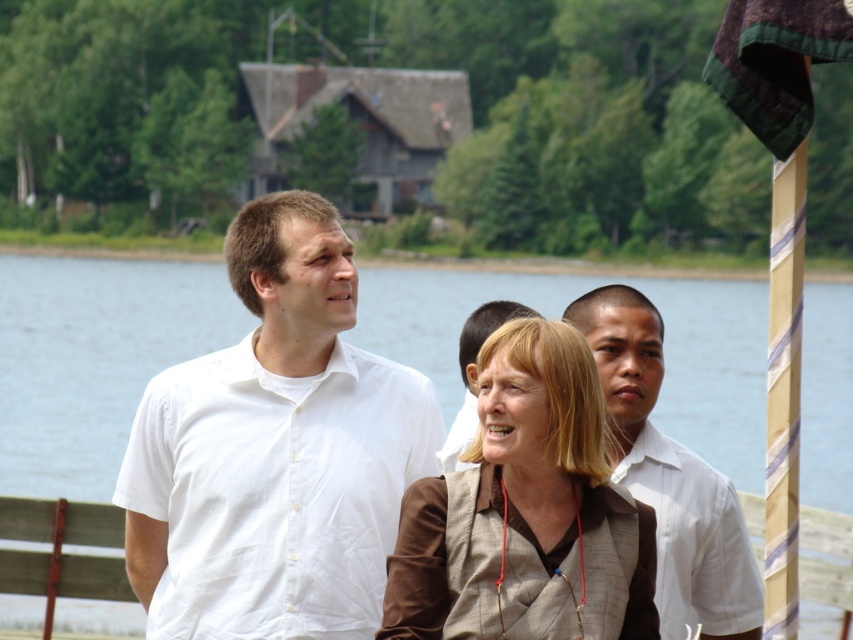
Question: Which object is positioned farthest from the white striped shirt at center?

Choices:
 (A) white cotton shirt at center
 (B) white shirt at center

Answer: (A)

Question: Which point is closer to the camera?

Choices:
 (A) white cotton shirt at center
 (B) transparent water at center
 (C) white shirt at center
 (D) white striped shirt at center

Answer: (B)

Question: Does brown textured vest at center have a greater width compared to white striped shirt at center?

Choices:
 (A) yes
 (B) no

Answer: (A)

Question: Is white cotton shirt at center in front of transparent water at center?

Choices:
 (A) yes
 (B) no

Answer: (B)

Question: Which point is closer to the camera?

Choices:
 (A) (726, 458)
 (B) (659, 346)
 (C) (505, 609)

Answer: (C)

Question: Is white cotton shirt at center smaller than white shirt at center?

Choices:
 (A) no
 (B) yes

Answer: (B)